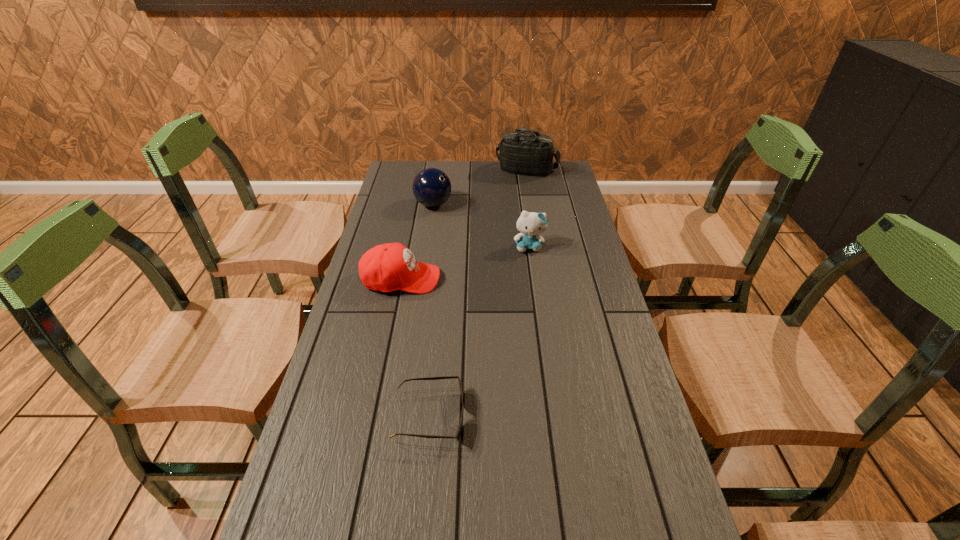
The image size is (960, 540). In order to click on vacant space located 0.150m on the face of the third farthest object in this screenshot , I will do `click(535, 286)`.

Identify the location of free space located 0.270m on the front panel of the second shortest object. This screenshot has height=540, width=960. (529, 279).

Where is `free spot located on the lenses of the nearest object`? The width and height of the screenshot is (960, 540). free spot located on the lenses of the nearest object is located at coordinates (629, 416).

The width and height of the screenshot is (960, 540). Identify the location of object located at the far edge. (522, 153).

Identify the location of bowling ball that is positioned at the left edge. This screenshot has width=960, height=540. (431, 187).

The height and width of the screenshot is (540, 960). I want to click on baseball cap located in the left edge section of the desktop, so click(x=388, y=267).

Locate an element on the screen. Image resolution: width=960 pixels, height=540 pixels. shoulder bag that is at the right edge is located at coordinates (522, 153).

The width and height of the screenshot is (960, 540). Identify the location of kitten that is at the right edge. (531, 224).

I want to click on object at the far right corner, so click(x=522, y=153).

Image resolution: width=960 pixels, height=540 pixels. What are the coordinates of `vacant point at the far edge` in the screenshot? It's located at (450, 172).